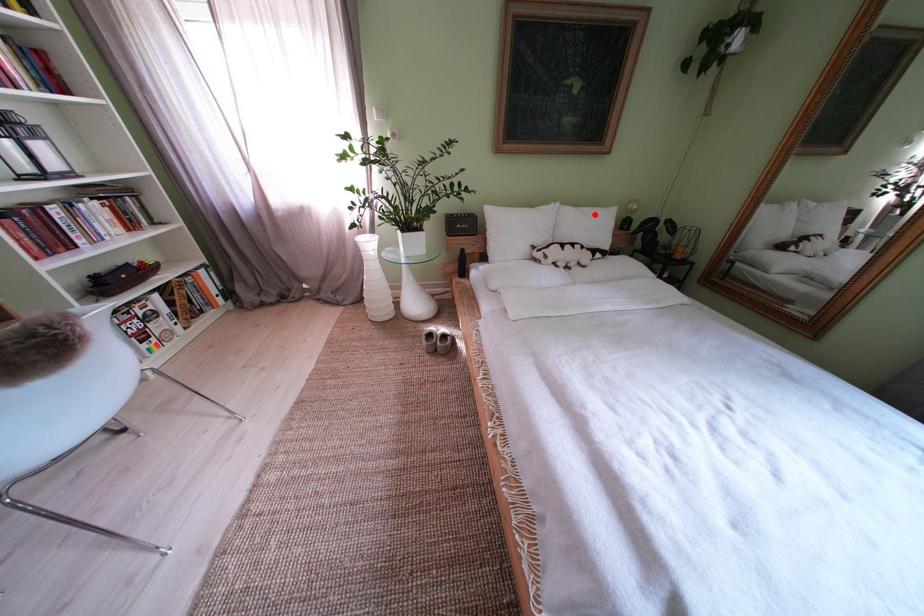
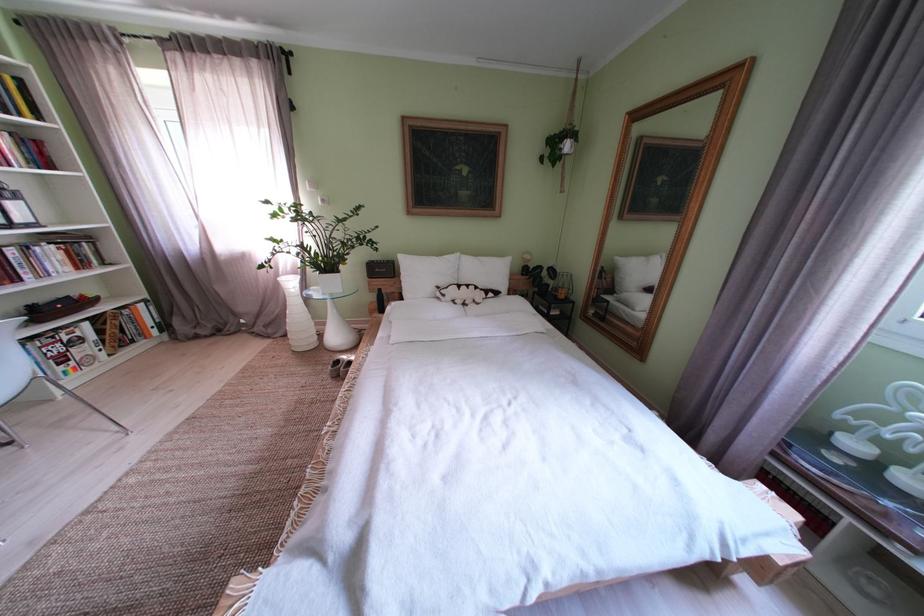
Where in the second image is the point corresponding to the highlighted location from the first image?

(492, 264)